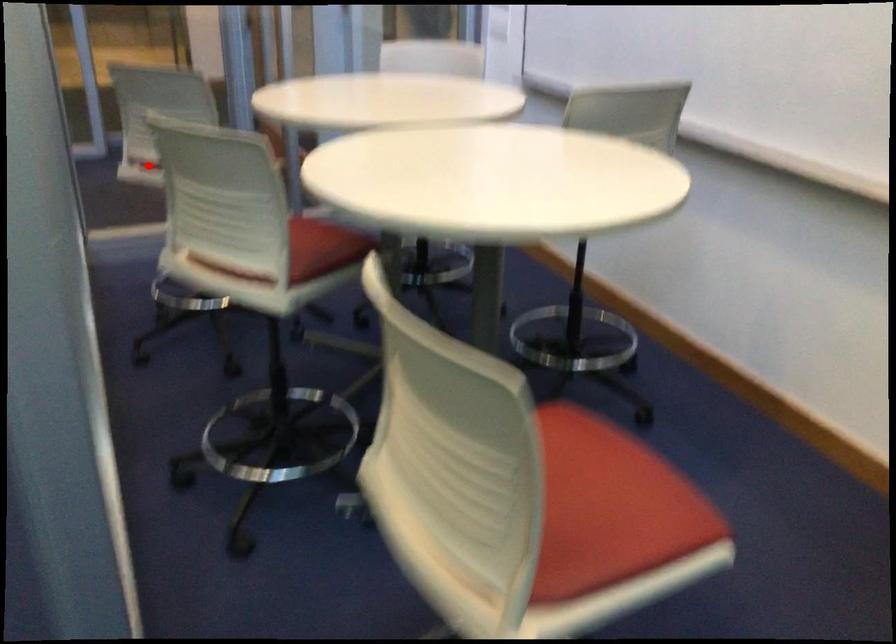
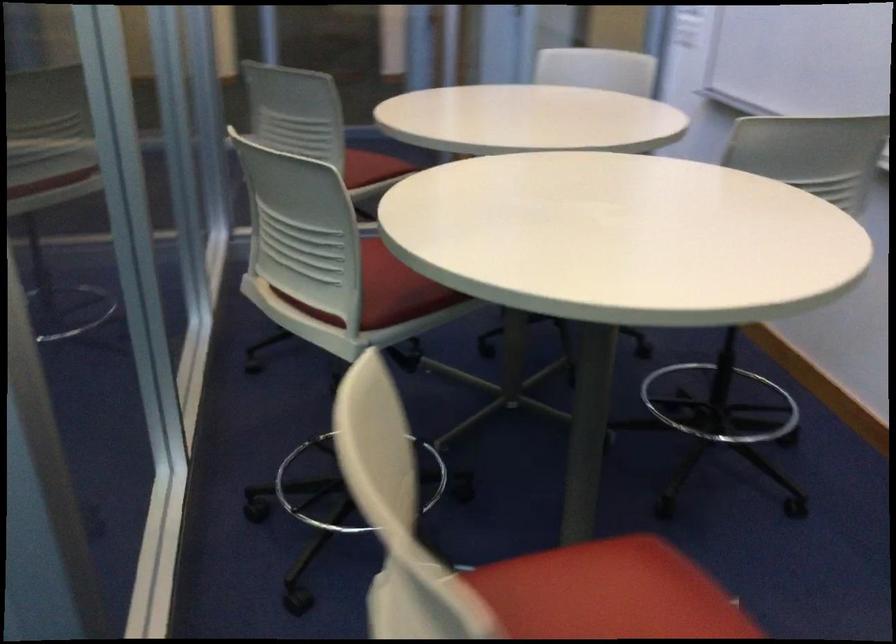
Question: I am providing you with two images of the same scene from different viewpoints. A red point is marked on the first image. At the location where the point appears in image 1, is it still visible in image 2?

Choices:
 (A) Yes
 (B) No

Answer: (B)